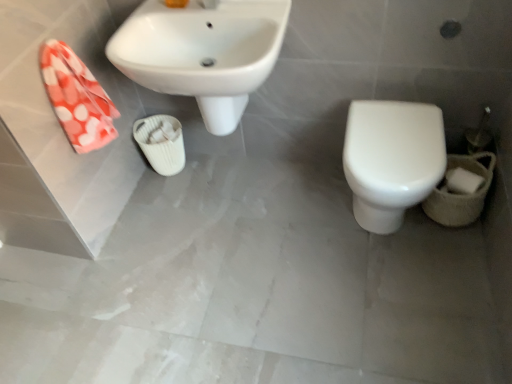
You are a GUI agent. You are given a task and a screenshot of the screen. Output one action in this format:
    pyautogui.click(x=<x>, y=<y>)
    Task: Click on the blank space to the left of white glossy toilet at lower right
    
    Given the screenshot: What is the action you would take?
    pyautogui.click(x=295, y=220)